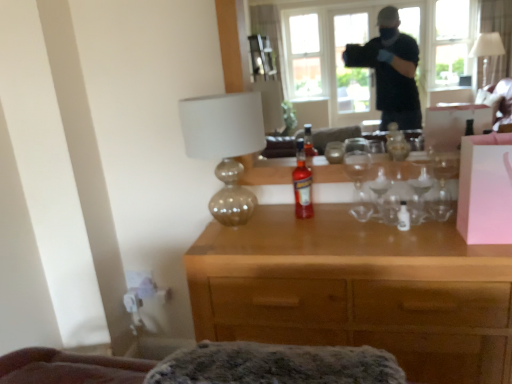
The image size is (512, 384). I want to click on vacant space to the left of pink matte box at right, so click(431, 244).